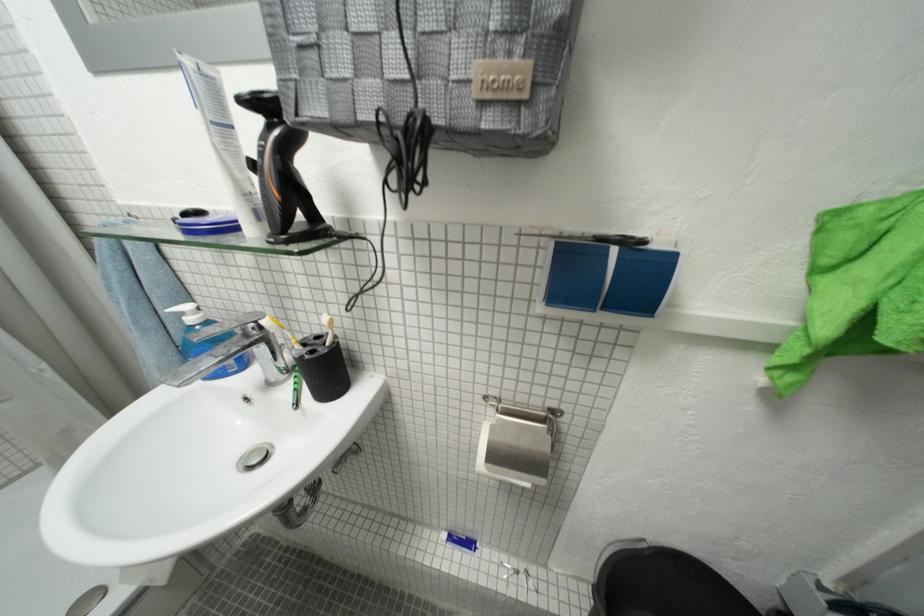
Image resolution: width=924 pixels, height=616 pixels. I want to click on metal holder cover, so pyautogui.click(x=517, y=450).